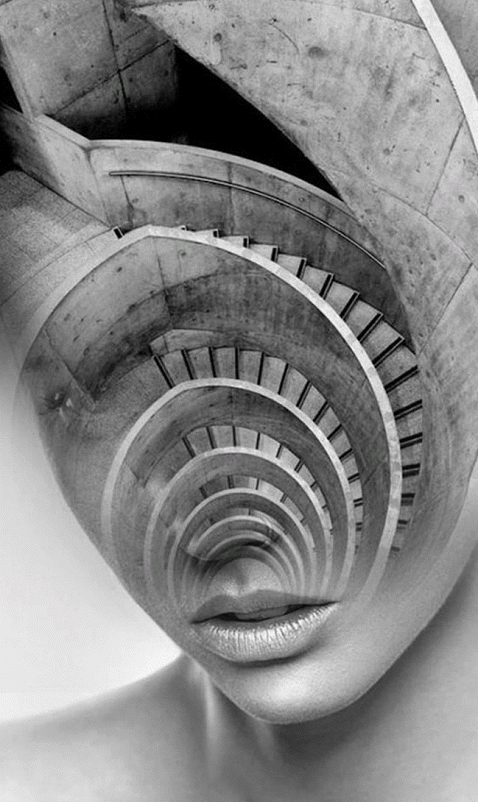
You are a GUI agent. You are given a task and a screenshot of the screen. Output one action in this format:
    pyautogui.click(x=<x>, y=<y>)
    Task: Click on the moving spiral staircase
    This screenshot has height=802, width=478.
    Given the screenshot: What is the action you would take?
    pyautogui.click(x=219, y=228)